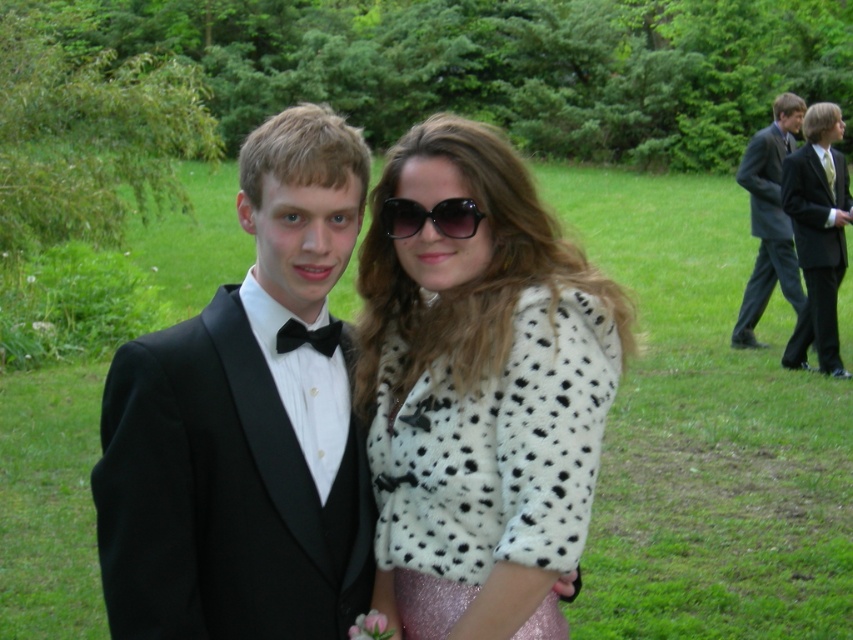
Question: Can you confirm if black satin suit at right is wider than dark gray suit at right?

Choices:
 (A) no
 (B) yes

Answer: (A)

Question: Which of the following is the closest to the observer?

Choices:
 (A) black plastic sunglasses at center
 (B) black satin suit at right

Answer: (A)

Question: Which point is farther from the camera taking this photo?

Choices:
 (A) (194, 388)
 (B) (788, 356)
 (C) (790, 269)
 (D) (328, 321)

Answer: (C)

Question: Does black satin tuxedo at left appear over black satin bow tie at center?

Choices:
 (A) no
 (B) yes

Answer: (A)

Question: Does black satin tuxedo at left have a greater width compared to black satin suit at right?

Choices:
 (A) yes
 (B) no

Answer: (B)

Question: Which point is farther to the camera?

Choices:
 (A) (364, 515)
 (B) (546, 618)
 (C) (764, 221)
 (D) (329, 349)

Answer: (C)